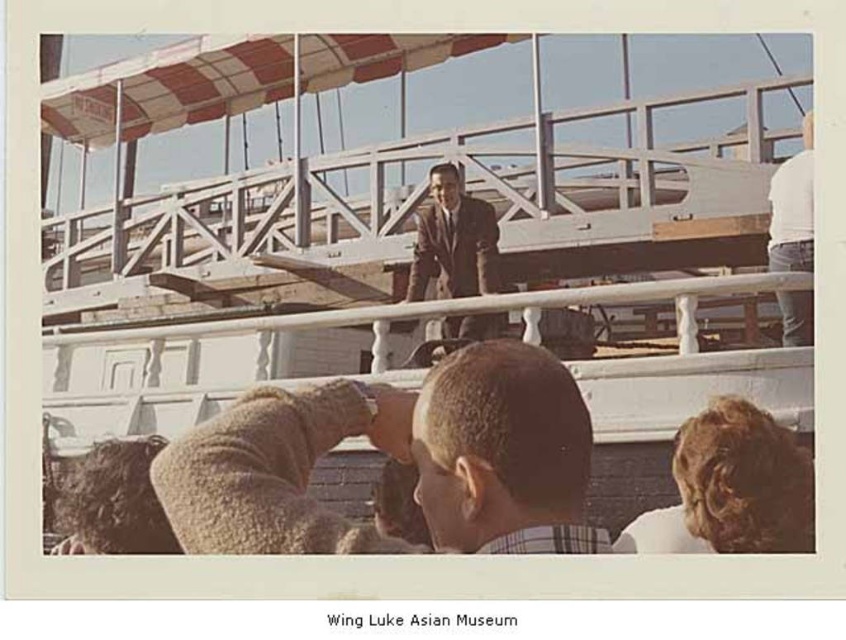
You are a photographer trying to capture the scene from the exact center of the image. You want to focus on the matte brown suit at center. What are the coordinates where you should aim your camera?

The coordinates to aim your camera are at point (454, 241), where the matte brown suit at center is located.

You are a photographer trying to capture a group photo of the light brown hair at center and the white cotton shirt at upper right. If your camera has a maximum focus range of 20 meters, will you be able to get both subjects in focus at the same time?

The light brown hair at center is 21.41 meters from the white cotton shirt at upper right. Since the distance between them exceeds the camera lens focus range of 20 meters, you cannot get both subjects in focus simultaneously.